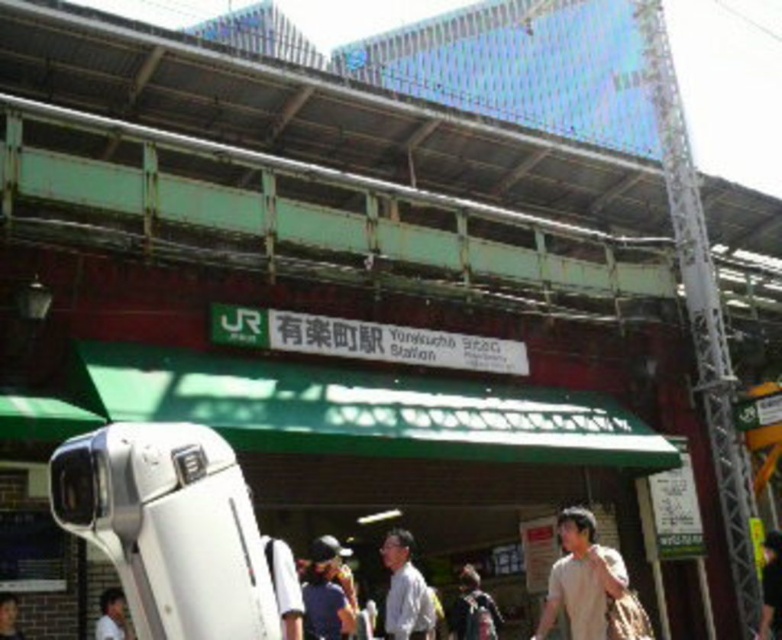
You are a photographer standing at the entrance of Yurakucho Station. You see a light brown cotton shirt at lower right and a blue fabric shirt at lower center. Which shirt is positioned lower in the image?

The light brown cotton shirt at lower right is positioned lower in the image than the blue fabric shirt at lower center.